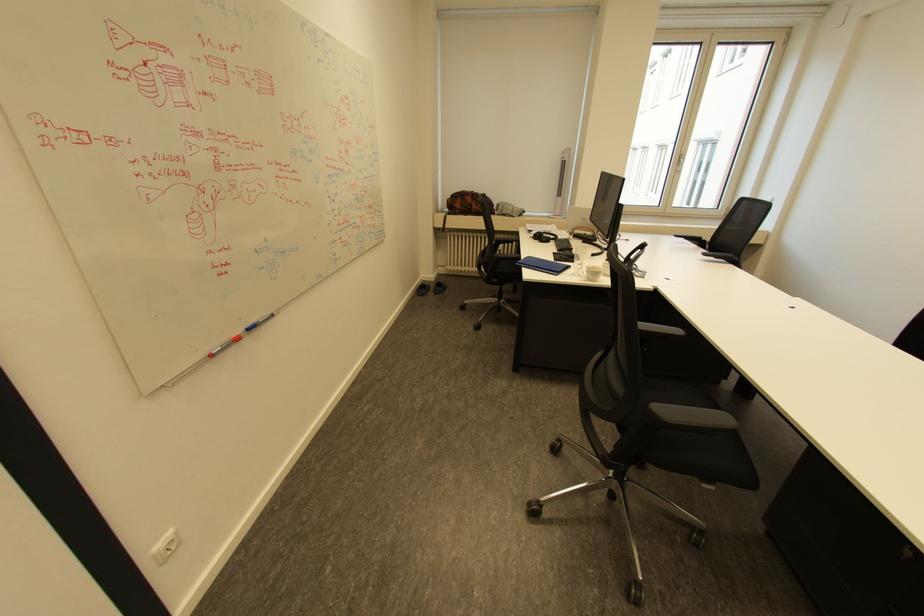
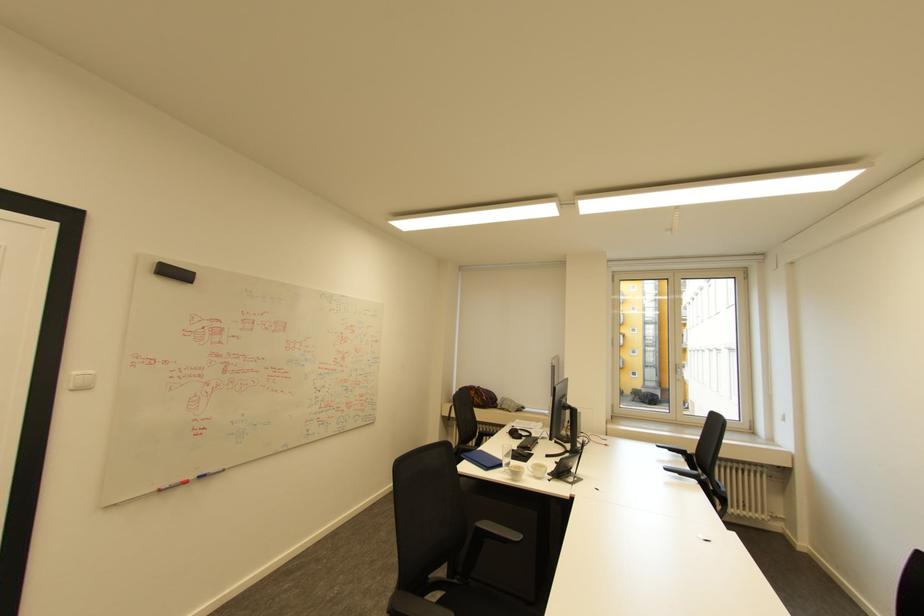
Where in the second image is the point corresponding to pixel 596 281 from the first image?

(518, 479)